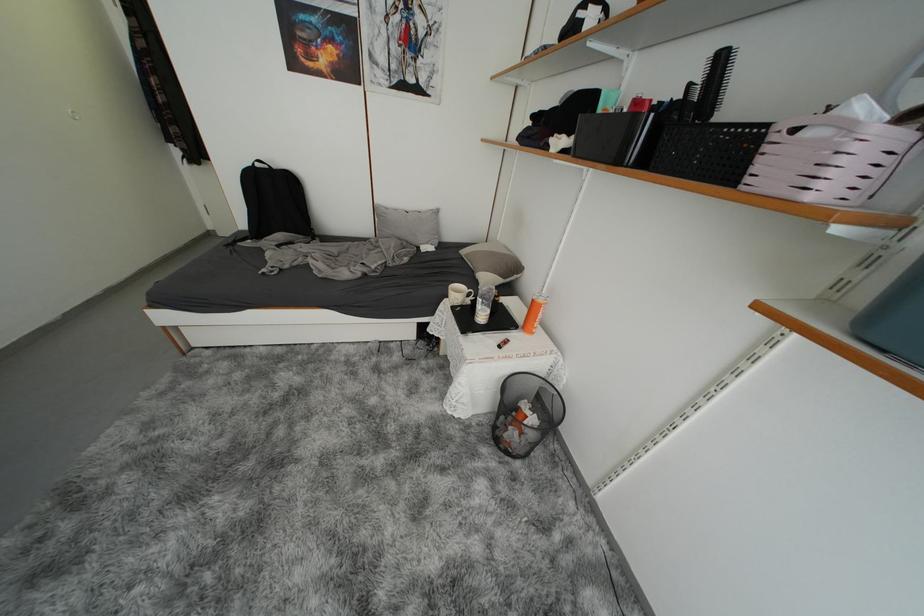
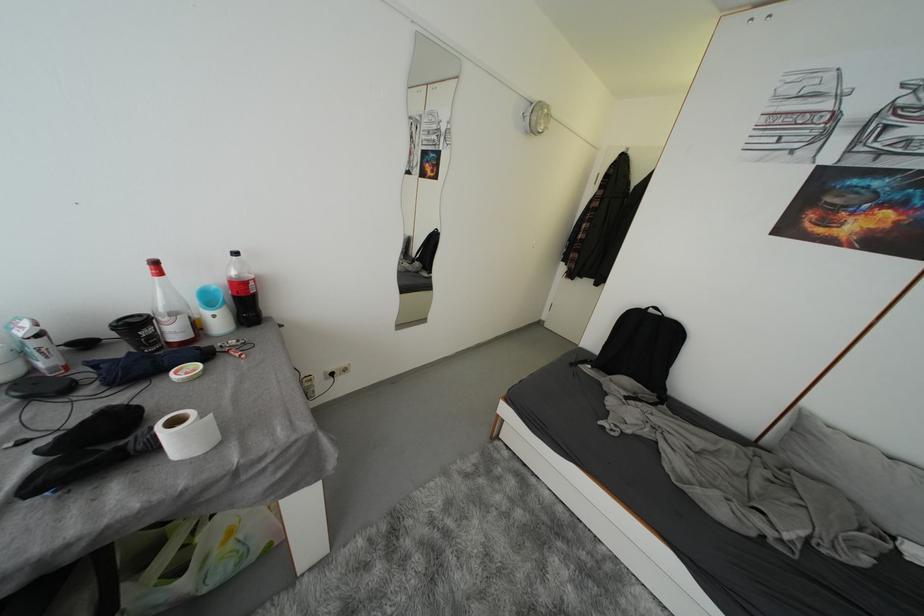
Find the pixel in the second image that matches point 264,169 in the first image.

(658, 314)